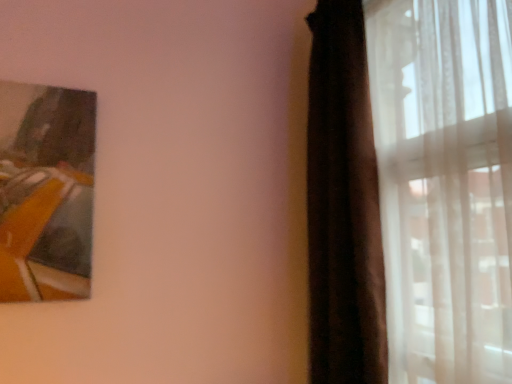
You are a GUI agent. You are given a task and a screenshot of the screen. Output one action in this format:
    pyautogui.click(x=<x>, y=<y>)
    Task: Click on the silky white curtain at right, arranged as the first curtain when viewed from the right
    The image size is (512, 384).
    Given the screenshot: What is the action you would take?
    pyautogui.click(x=410, y=191)

This screenshot has height=384, width=512. What do you see at coordinates (410, 191) in the screenshot? I see `silky white curtain at right, which is counted as the second curtain, starting from the left` at bounding box center [410, 191].

Measure the distance between point [492,366] and camera.

Point [492,366] is 96.80 centimeters from camera.

What is the approximate width of silky white curtain at right, arranged as the first curtain when viewed from the right?

It is 5.63 inches.

Identify the location of brown velvet curtain at right, the first curtain viewed from the left. The image size is (512, 384). (343, 205).

The image size is (512, 384). What do you see at coordinates (343, 205) in the screenshot? I see `brown velvet curtain at right, marked as the 2th curtain in a right-to-left arrangement` at bounding box center [343, 205].

You are a GUI agent. You are given a task and a screenshot of the screen. Output one action in this format:
    pyautogui.click(x=<x>, y=<y>)
    Task: Click on the silky white curtain at right, arranged as the first curtain when viewed from the right
    
    Given the screenshot: What is the action you would take?
    pyautogui.click(x=410, y=191)

Is silky white curtain at right, arranged as the first curtain when viewed from the right, to the left of brown velvet curtain at right, marked as the 2th curtain in a right-to-left arrangement, from the viewer's perspective?

Incorrect, silky white curtain at right, arranged as the first curtain when viewed from the right, is not on the left side of brown velvet curtain at right, marked as the 2th curtain in a right-to-left arrangement.

Which is in front, silky white curtain at right, arranged as the first curtain when viewed from the right, or brown velvet curtain at right, the first curtain viewed from the left?

silky white curtain at right, arranged as the first curtain when viewed from the right, is more forward.

Considering the positions of points (332, 144) and (321, 316), is point (332, 144) closer to camera compared to point (321, 316)?

No, it is not.

From the image's perspective, relative to brown velvet curtain at right, marked as the 2th curtain in a right-to-left arrangement, is silky white curtain at right, which is counted as the second curtain, starting from the left, above or below?

From the image's perspective, silky white curtain at right, which is counted as the second curtain, starting from the left, appears above brown velvet curtain at right, marked as the 2th curtain in a right-to-left arrangement.

From a real-world perspective, does silky white curtain at right, arranged as the first curtain when viewed from the right, sit lower than brown velvet curtain at right, marked as the 2th curtain in a right-to-left arrangement?

Correct, in the physical world, silky white curtain at right, arranged as the first curtain when viewed from the right, is lower than brown velvet curtain at right, marked as the 2th curtain in a right-to-left arrangement.

Between silky white curtain at right, arranged as the first curtain when viewed from the right, and brown velvet curtain at right, the first curtain viewed from the left, which one has smaller width?

Thinner between the two is silky white curtain at right, arranged as the first curtain when viewed from the right.

Is silky white curtain at right, arranged as the first curtain when viewed from the right, taller or shorter than brown velvet curtain at right, marked as the 2th curtain in a right-to-left arrangement?

silky white curtain at right, arranged as the first curtain when viewed from the right, is shorter than brown velvet curtain at right, marked as the 2th curtain in a right-to-left arrangement.

Considering the relative sizes of silky white curtain at right, arranged as the first curtain when viewed from the right, and brown velvet curtain at right, the first curtain viewed from the left, in the image provided, is silky white curtain at right, arranged as the first curtain when viewed from the right, bigger than brown velvet curtain at right, the first curtain viewed from the left,?

Yes.

Is brown velvet curtain at right, the first curtain viewed from the left, surrounded by silky white curtain at right, which is counted as the second curtain, starting from the left?

Yes, brown velvet curtain at right, the first curtain viewed from the left, is a part of silky white curtain at right, which is counted as the second curtain, starting from the left.

Can you see silky white curtain at right, arranged as the first curtain when viewed from the right, touching brown velvet curtain at right, marked as the 2th curtain in a right-to-left arrangement?

Yes, silky white curtain at right, arranged as the first curtain when viewed from the right, is touching brown velvet curtain at right, marked as the 2th curtain in a right-to-left arrangement.

Is silky white curtain at right, which is counted as the second curtain, starting from the left, oriented towards brown velvet curtain at right, the first curtain viewed from the left?

Yes, silky white curtain at right, which is counted as the second curtain, starting from the left, is aimed at brown velvet curtain at right, the first curtain viewed from the left.

Measure the distance from silky white curtain at right, which is counted as the second curtain, starting from the left, to brown velvet curtain at right, marked as the 2th curtain in a right-to-left arrangement.

silky white curtain at right, which is counted as the second curtain, starting from the left, is 3.55 inches from brown velvet curtain at right, marked as the 2th curtain in a right-to-left arrangement.

Where is `curtain that appears in front of the brown velvet curtain at right, marked as the 2th curtain in a right-to-left arrangement`? curtain that appears in front of the brown velvet curtain at right, marked as the 2th curtain in a right-to-left arrangement is located at coordinates (410, 191).

Does brown velvet curtain at right, marked as the 2th curtain in a right-to-left arrangement, appear on the right side of silky white curtain at right, arranged as the first curtain when viewed from the right?

No, brown velvet curtain at right, marked as the 2th curtain in a right-to-left arrangement, is not to the right of silky white curtain at right, arranged as the first curtain when viewed from the right.

Who is more distant, brown velvet curtain at right, the first curtain viewed from the left, or silky white curtain at right, arranged as the first curtain when viewed from the right?

brown velvet curtain at right, the first curtain viewed from the left, is behind.

Is point (311, 182) positioned before point (411, 190)?

No, (311, 182) is behind (411, 190).

From the image's perspective, is brown velvet curtain at right, the first curtain viewed from the left, positioned above or below silky white curtain at right, which is counted as the second curtain, starting from the left?

Based on their image positions, brown velvet curtain at right, the first curtain viewed from the left, is located beneath silky white curtain at right, which is counted as the second curtain, starting from the left.

From a real-world perspective, is brown velvet curtain at right, the first curtain viewed from the left, located higher than silky white curtain at right, arranged as the first curtain when viewed from the right?

Yes, from a real-world perspective, brown velvet curtain at right, the first curtain viewed from the left, is on top of silky white curtain at right, arranged as the first curtain when viewed from the right.

Considering the relative sizes of brown velvet curtain at right, the first curtain viewed from the left, and silky white curtain at right, which is counted as the second curtain, starting from the left, in the image provided, is brown velvet curtain at right, the first curtain viewed from the left, thinner than silky white curtain at right, which is counted as the second curtain, starting from the left,?

No, brown velvet curtain at right, the first curtain viewed from the left, is not thinner than silky white curtain at right, which is counted as the second curtain, starting from the left.

Considering the relative sizes of brown velvet curtain at right, marked as the 2th curtain in a right-to-left arrangement, and silky white curtain at right, which is counted as the second curtain, starting from the left, in the image provided, is brown velvet curtain at right, marked as the 2th curtain in a right-to-left arrangement, shorter than silky white curtain at right, which is counted as the second curtain, starting from the left,?

No, brown velvet curtain at right, marked as the 2th curtain in a right-to-left arrangement, is not shorter than silky white curtain at right, which is counted as the second curtain, starting from the left.

Does brown velvet curtain at right, the first curtain viewed from the left, have a smaller size compared to silky white curtain at right, arranged as the first curtain when viewed from the right?

Yes, brown velvet curtain at right, the first curtain viewed from the left, is smaller than silky white curtain at right, arranged as the first curtain when viewed from the right.

Could silky white curtain at right, arranged as the first curtain when viewed from the right, be considered to be inside brown velvet curtain at right, the first curtain viewed from the left?

Yes, silky white curtain at right, arranged as the first curtain when viewed from the right, is surrounded by brown velvet curtain at right, the first curtain viewed from the left.

Would you consider brown velvet curtain at right, marked as the 2th curtain in a right-to-left arrangement, to be distant from silky white curtain at right, arranged as the first curtain when viewed from the right?

No, brown velvet curtain at right, marked as the 2th curtain in a right-to-left arrangement, is in close proximity to silky white curtain at right, arranged as the first curtain when viewed from the right.

Is brown velvet curtain at right, the first curtain viewed from the left, aimed at silky white curtain at right, arranged as the first curtain when viewed from the right?

Yes, brown velvet curtain at right, the first curtain viewed from the left, is facing silky white curtain at right, arranged as the first curtain when viewed from the right.

How different are the orientations of brown velvet curtain at right, marked as the 2th curtain in a right-to-left arrangement, and silky white curtain at right, which is counted as the second curtain, starting from the left, in degrees?

The angle between the facing direction of brown velvet curtain at right, marked as the 2th curtain in a right-to-left arrangement, and the facing direction of silky white curtain at right, which is counted as the second curtain, starting from the left, is 90.4 degrees.

Could you measure the distance between brown velvet curtain at right, marked as the 2th curtain in a right-to-left arrangement, and silky white curtain at right, which is counted as the second curtain, starting from the left?

9.01 centimeters.

Where is `curtain above the silky white curtain at right, arranged as the first curtain when viewed from the right (from a real-world perspective)`? curtain above the silky white curtain at right, arranged as the first curtain when viewed from the right (from a real-world perspective) is located at coordinates (343, 205).

This screenshot has width=512, height=384. What are the coordinates of `curtain above the brown velvet curtain at right, the first curtain viewed from the left (from the image's perspective)` in the screenshot? It's located at (410, 191).

Find the location of `curtain above the silky white curtain at right, which is counted as the second curtain, starting from the left (from a real-world perspective)`. curtain above the silky white curtain at right, which is counted as the second curtain, starting from the left (from a real-world perspective) is located at coordinates (343, 205).